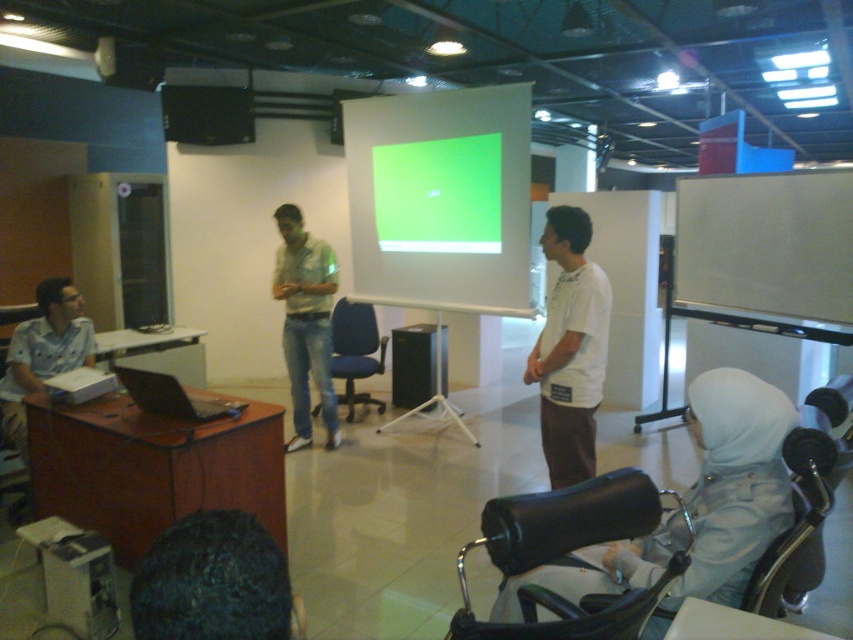
Question: Which of the following is the farthest from the observer?

Choices:
 (A) (711, 444)
 (B) (308, 422)
 (C) (355, 349)
 (D) (20, 346)

Answer: (C)

Question: Does blue fabric chair at center have a larger size compared to black glossy laptop at left?

Choices:
 (A) yes
 (B) no

Answer: (A)

Question: Which point is farther from the camera taking this photo?

Choices:
 (A) (244, 618)
 (B) (477, 216)
 (C) (352, 307)
 (D) (325, 442)

Answer: (C)

Question: Can you confirm if white fabric headscarf at lower right is thinner than black glossy laptop at left?

Choices:
 (A) no
 (B) yes

Answer: (A)

Question: Observing the image, what is the correct spatial positioning of black leather chair at lower right in reference to black glossy laptop at left?

Choices:
 (A) above
 (B) below

Answer: (B)

Question: Which point is farther to the camera?

Choices:
 (A) white fabric headscarf at lower right
 (B) green matte shirt at center
 (C) white matte shirt at center

Answer: (B)